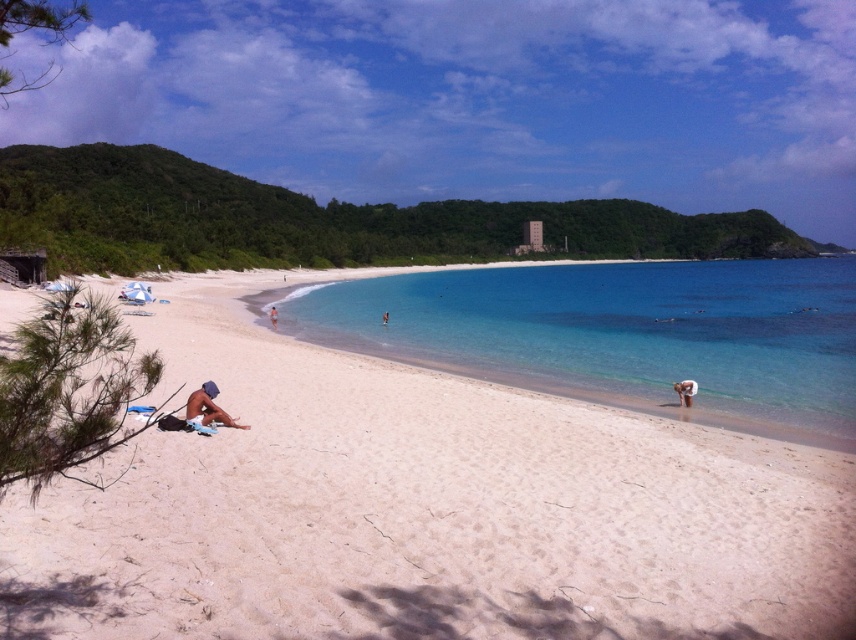
Describe the element at coordinates (419, 508) in the screenshot. I see `white sand at center` at that location.

Is point (210, 621) closer to viewer compared to point (756, 220)?

Yes, point (210, 621) is in front of point (756, 220).

Who is more distant from viewer, (155, 396) or (62, 154)?

The point (62, 154) is behind.

I want to click on white sand at center, so click(419, 508).

Between point (171, 611) and point (694, 390), which one is positioned in front?

Point (171, 611)

Looking at this image, does white sand at center appear under tan skin person at lower right?

Actually, white sand at center is above tan skin person at lower right.

Where is `white sand at center`? The width and height of the screenshot is (856, 640). white sand at center is located at coordinates (419, 508).

The image size is (856, 640). What are the coordinates of `white sand at center` in the screenshot? It's located at (419, 508).

Looking at this image, who is more forward, (484, 310) or (272, 320)?

Positioned in front is point (272, 320).

Between clear blue water at center and tan skin person at center, which one has more height?

Standing taller between the two is clear blue water at center.

Who is more forward, (x=828, y=337) or (x=272, y=314)?

Point (x=828, y=337) is more forward.

The image size is (856, 640). In order to click on clear blue water at center in this screenshot , I will do `click(622, 333)`.